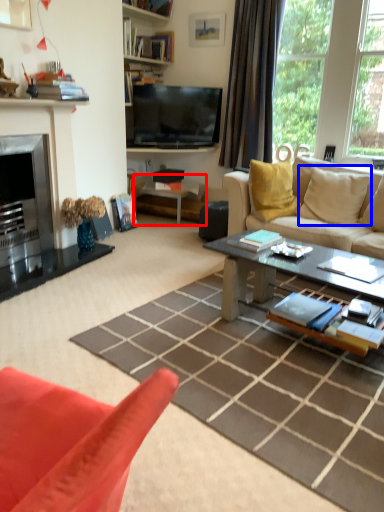
Question: Among these objects, which one is nearest to the camera, side table (highlighted by a red box) or pillow (highlighted by a blue box)?

Choices:
 (A) side table
 (B) pillow

Answer: (B)